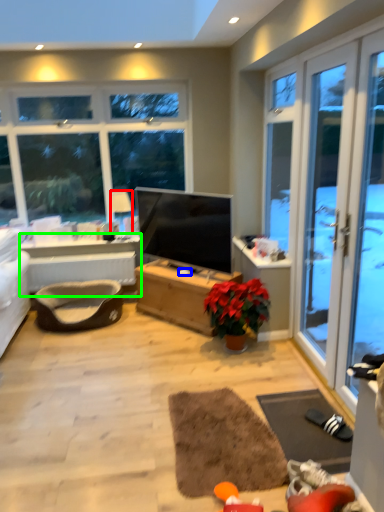
Question: Based on their relative distances, which object is nearer to lamp (highlighted by a red box)? Choose from loudspeaker (highlighted by a blue box) and table (highlighted by a green box).

Choices:
 (A) loudspeaker
 (B) table

Answer: (B)